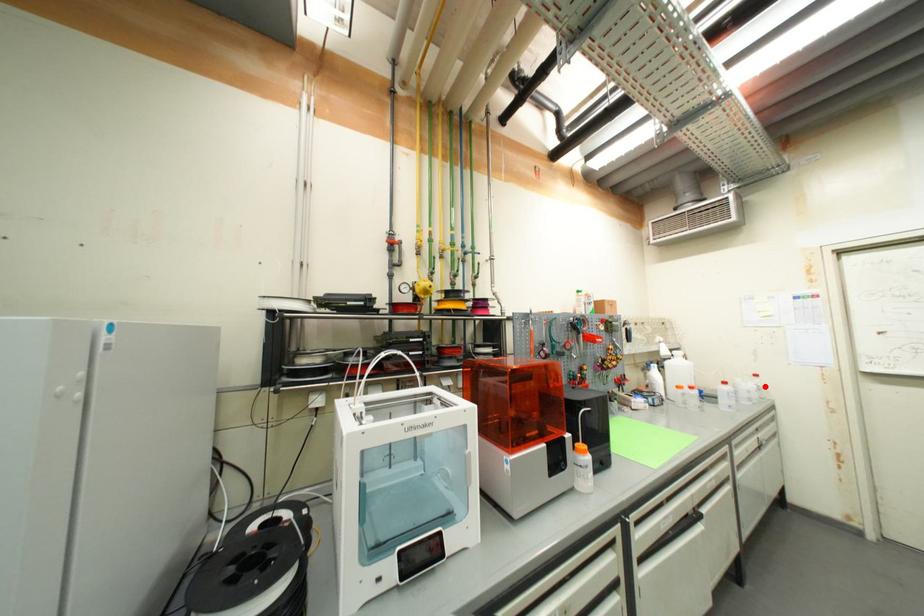
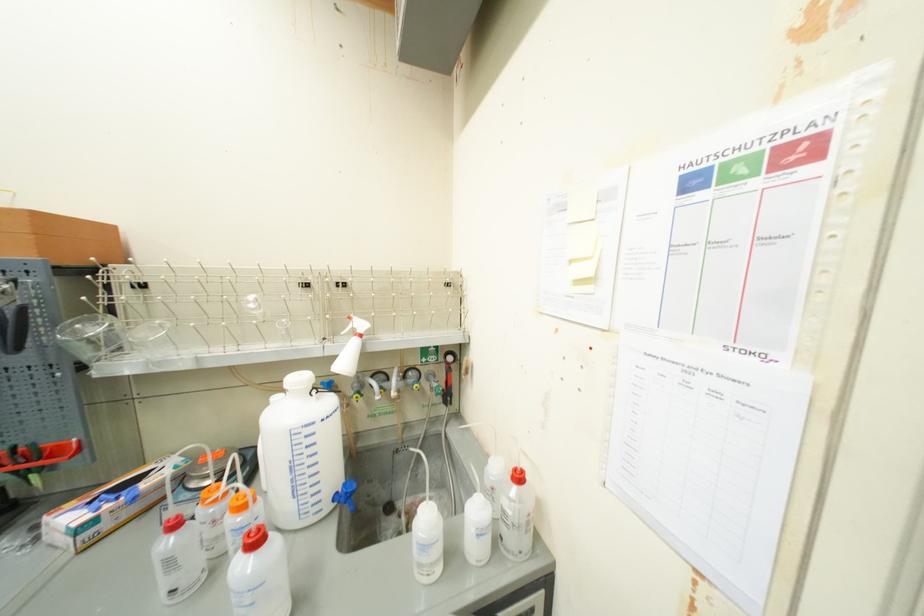
Find the pixel in the second image that matches the highlighted location in the first image.

(515, 514)